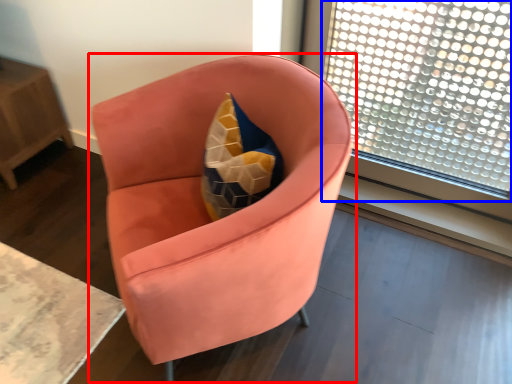
Question: Which object appears farthest to the camera in this image, chair (highlighted by a red box) or window (highlighted by a blue box)?

Choices:
 (A) chair
 (B) window

Answer: (B)